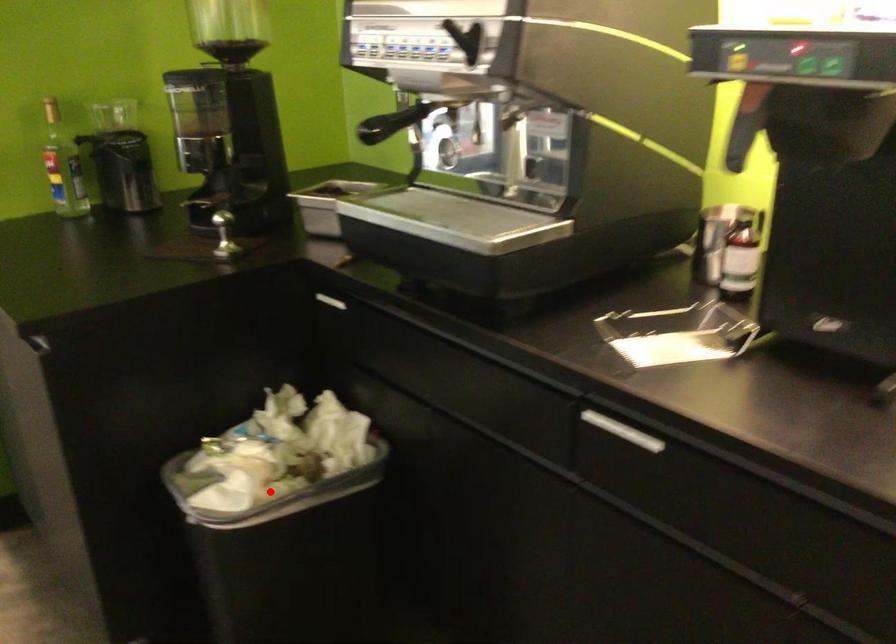
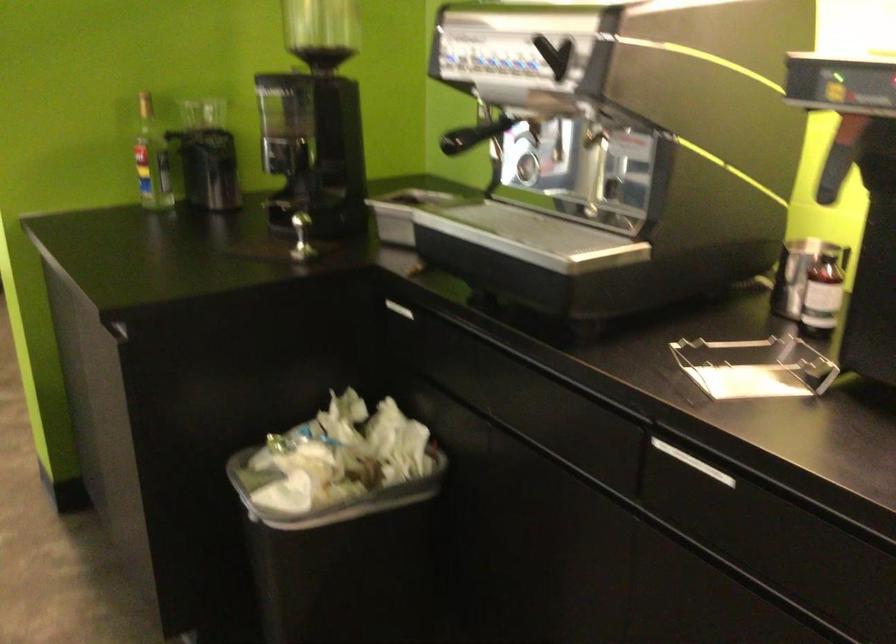
The point at the highlighted location is marked in the first image. Where is the corresponding point in the second image?

(328, 495)